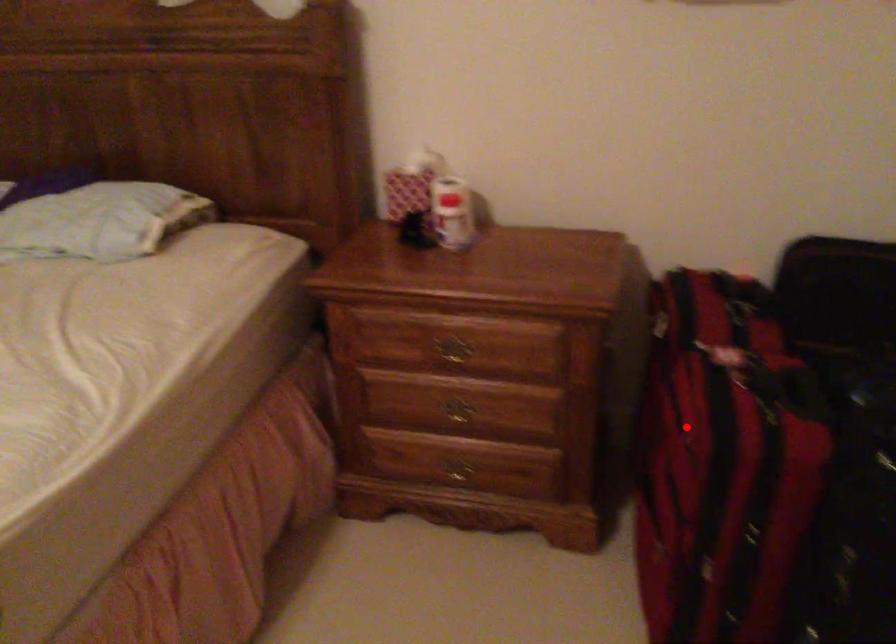
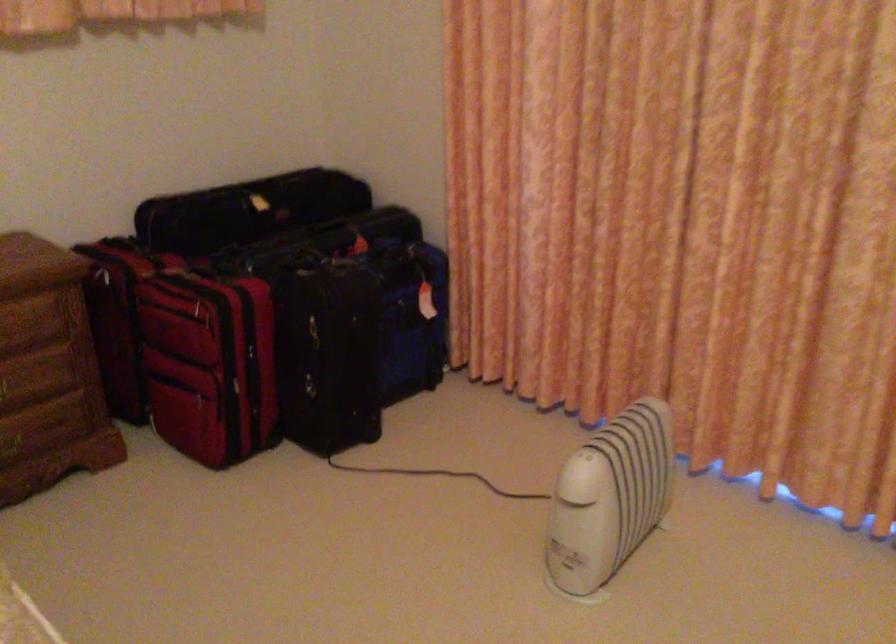
Where in the second image is the point corresponding to the highlighted location from the first image?

(202, 305)